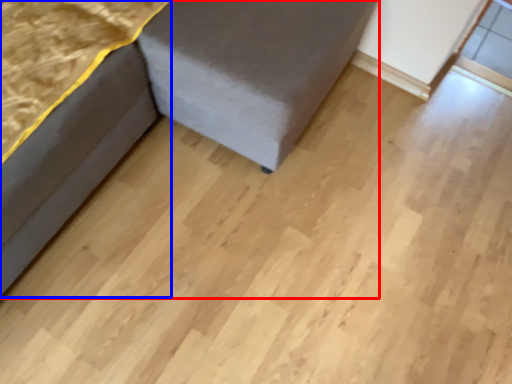
Question: Among these objects, which one is farthest to the camera, furniture (highlighted by a red box) or furniture (highlighted by a blue box)?

Choices:
 (A) furniture
 (B) furniture

Answer: (B)